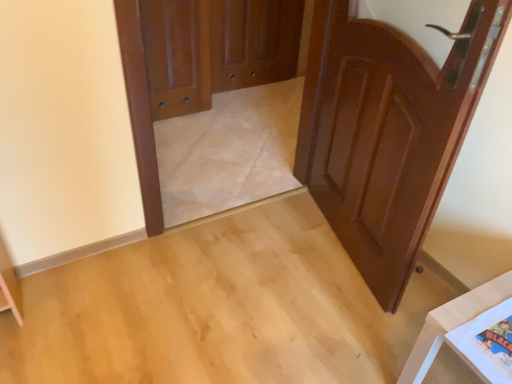
Identify the location of vacant region to the right of polished wood door at upper left, which is counted as the first door, starting from the back. Image resolution: width=512 pixels, height=384 pixels. (220, 121).